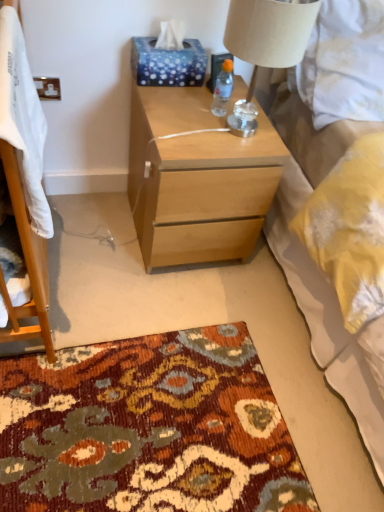
Image resolution: width=384 pixels, height=512 pixels. In order to click on spots to the right of transparent plastic bottle at upper center in this screenshot , I will do `click(250, 122)`.